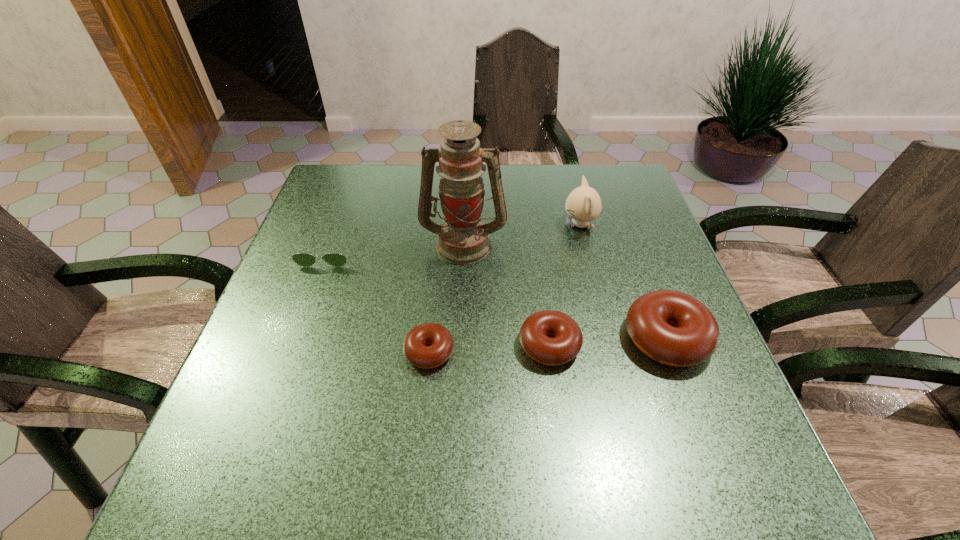
The height and width of the screenshot is (540, 960). I want to click on the shortest doughnut, so click(x=415, y=350).

Locate an element on the screen. The height and width of the screenshot is (540, 960). the third object from right to left is located at coordinates (568, 339).

The width and height of the screenshot is (960, 540). Find the location of `the second doughnut from right to left`. the second doughnut from right to left is located at coordinates (568, 339).

Identify the location of the tallest doughnut. (671, 327).

The height and width of the screenshot is (540, 960). Find the location of `the rightmost doughnut`. the rightmost doughnut is located at coordinates (671, 327).

Locate an element on the screen. The image size is (960, 540). kitten is located at coordinates tap(583, 204).

What are the coordinates of `the tallest object` in the screenshot? It's located at (463, 238).

Find the location of a particular element. sunglasses is located at coordinates (302, 259).

In order to click on blank space located on the right of the leftmost doughnut in this screenshot , I will do `click(545, 352)`.

Find the location of a particular element. Image resolution: width=960 pixels, height=540 pixels. free space located on the left of the fourth tallest object is located at coordinates (345, 345).